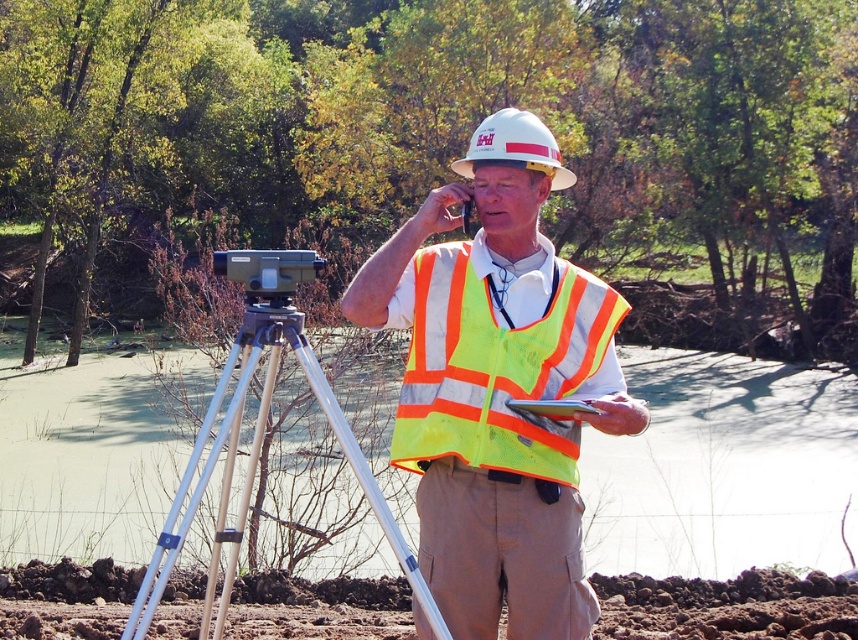
You are a safety inspector standing at the original position. You need to check the distance between the neon yellow reflective vest at center and yourself. According to the safety regulations, the minimum safe distance for this equipment is 4 meters. Is the current distance compliant with the regulations?

The distance between the neon yellow reflective vest at center and the viewer is 3.96 meters, which is slightly less than the required 4 meters. Therefore, the current distance does not comply with the safety regulations.